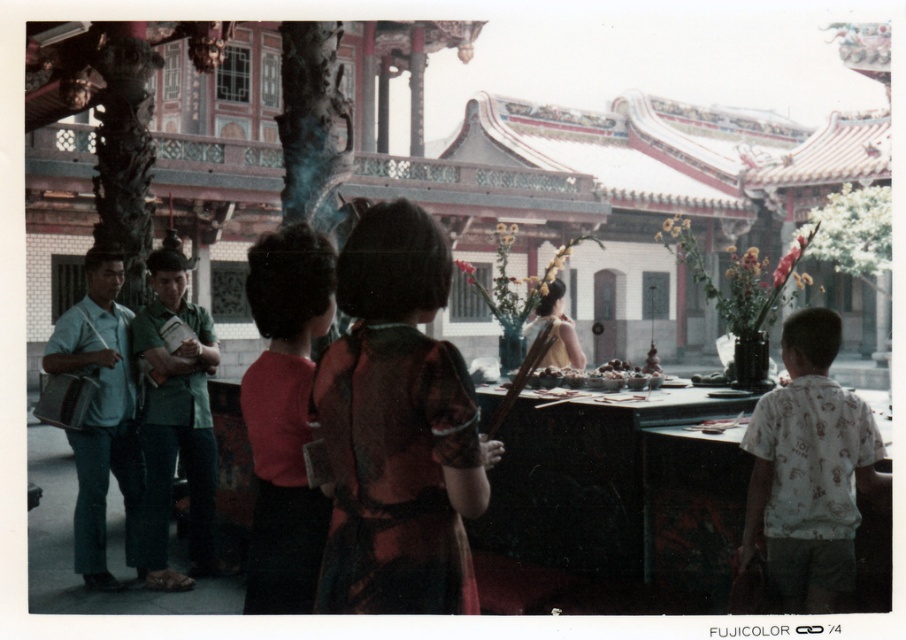
Consider the image. You are an artist observing the traditional Chinese courtyard scene. You notice the matte green shirt at left and the matte gold hairpin at center. Which object takes up more visual space in the image?

The matte gold hairpin at center takes up more visual space than the matte green shirt at left because the matte green shirt at left occupies less space than matte gold hairpin at center.